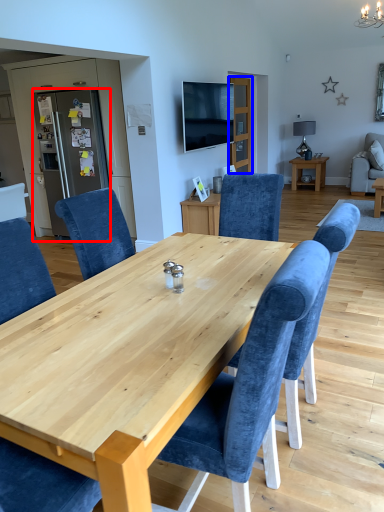
Question: Which object is further to the camera taking this photo, refrigerator (highlighted by a red box) or glass door (highlighted by a blue box)?

Choices:
 (A) refrigerator
 (B) glass door

Answer: (B)